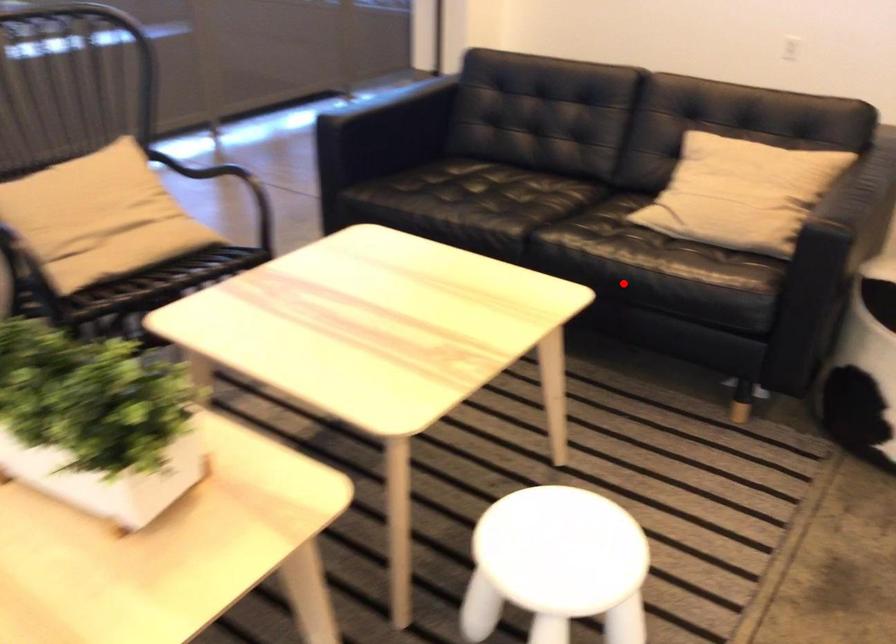
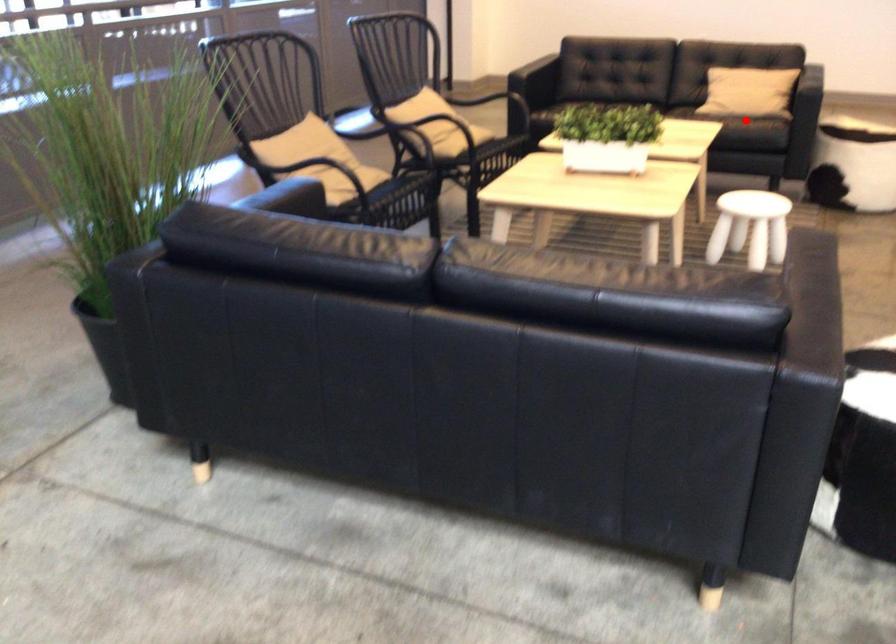
I am providing you with two images of the same scene from different viewpoints. A red point is marked on the first image and another point is marked on the second image. Are the points marked in image1 and image2 representing the same 3D position?

Yes